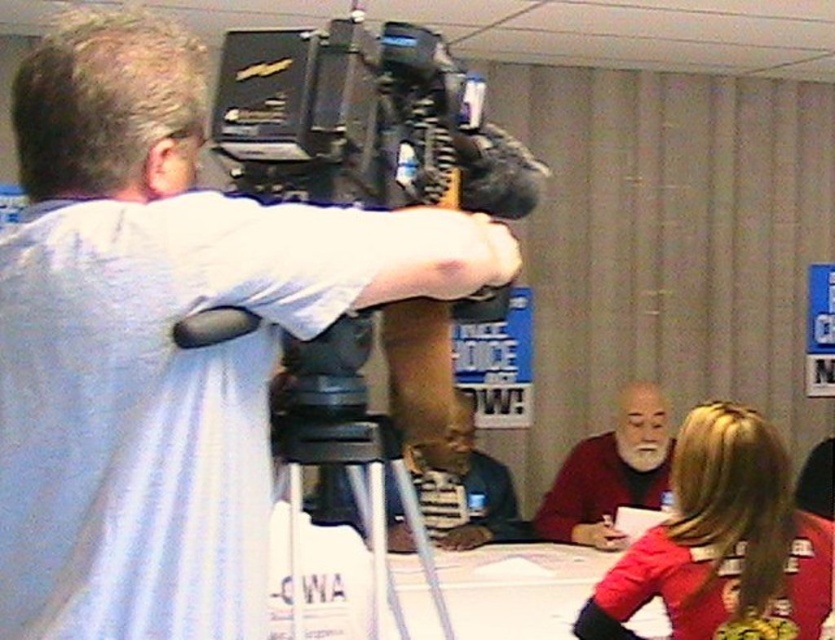
In the scene shown: Does black plastic tripod at center come in front of bearded man at center?

Yes, black plastic tripod at center is in front of bearded man at center.

The height and width of the screenshot is (640, 835). What do you see at coordinates (357, 499) in the screenshot?
I see `black plastic tripod at center` at bounding box center [357, 499].

Is point (395, 600) behind point (616, 448)?

No, (395, 600) is closer to viewer.

Find the location of a particular element. black plastic tripod at center is located at coordinates (357, 499).

Which of these two, red fabric shirt at lower right or black plastic tripod at center, stands shorter?

black plastic tripod at center

Can you confirm if red fabric shirt at lower right is taller than black plastic tripod at center?

Yes, red fabric shirt at lower right is taller than black plastic tripod at center.

Is point (722, 554) positioned in front of point (282, 436)?

No, (722, 554) is further to viewer.

At what (x,y) coordinates should I click in order to perform the action: click on red fabric shirt at lower right. Please return your answer as a coordinate pair (x, y). Image resolution: width=835 pixels, height=640 pixels. Looking at the image, I should click on (722, 544).

Does red fabric shirt at lower right have a greater height compared to bearded man at center?

In fact, red fabric shirt at lower right may be shorter than bearded man at center.

Is point (717, 620) farther from camera compared to point (575, 512)?

No, it is not.

Who is more forward, [757,492] or [655,492]?

Point [757,492]

Where is `red fabric shirt at lower right`? Image resolution: width=835 pixels, height=640 pixels. red fabric shirt at lower right is located at coordinates (722, 544).